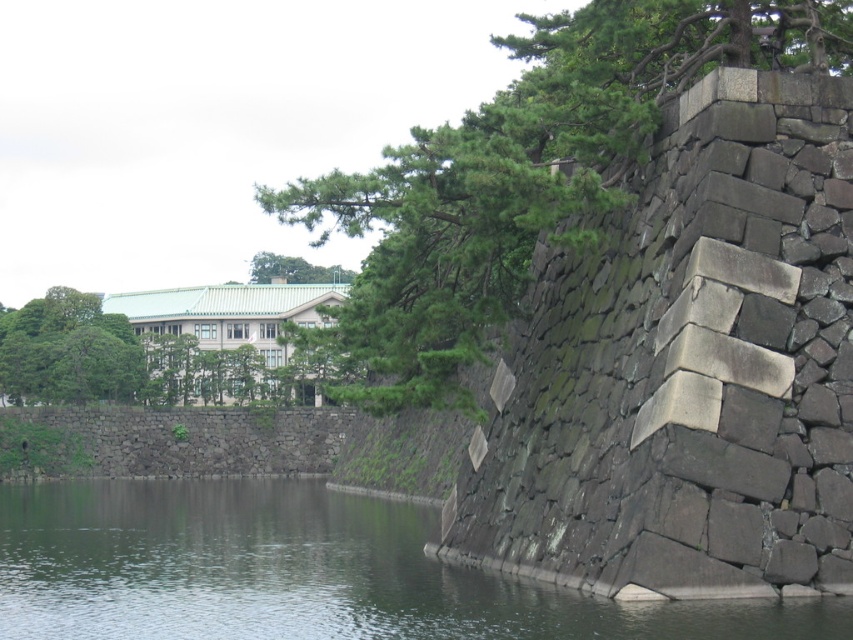
You are standing in front of the stone wall and notice two green leafy trees in the background. Which tree, the green leafy tree at upper left or the green leafy tree at upper center, is closer to you?

The green leafy tree at upper left is closer to the viewer than the green leafy tree at upper center.

You are a hiker standing at the base of the green leafy tree at upper left and want to cross to the green stone wall at lower left. Is the wall directly below the tree, making it easy to walk down?

Yes, the green stone wall at lower left is directly below the green leafy tree at upper left, so you can easily walk down to it.